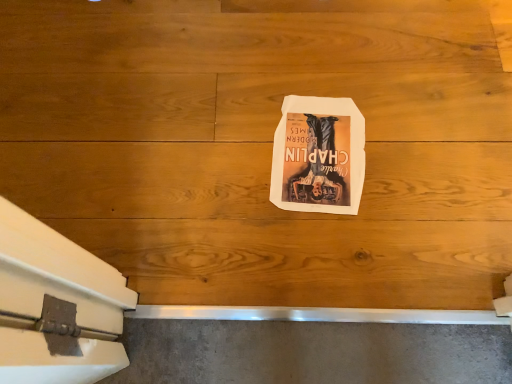
The height and width of the screenshot is (384, 512). I want to click on vacant region below white paper at center (from a real-world perspective), so pyautogui.click(x=309, y=139).